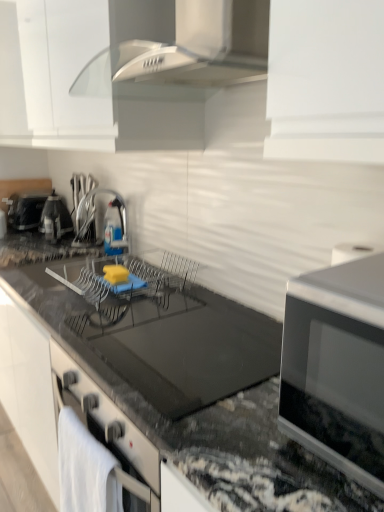
Question: Is satin nickel faucet at center, which ranks as the 1th appliance in front-to-back order, bigger or smaller than transparent plastic bottle at center?

Choices:
 (A) small
 (B) big

Answer: (B)

Question: From a real-world perspective, is satin nickel faucet at center, which ranks as the 1th appliance in front-to-back order, physically located above or below transparent plastic bottle at center?

Choices:
 (A) above
 (B) below

Answer: (A)

Question: Which of these objects is positioned farthest from the black glass countertop at center?

Choices:
 (A) transparent plastic bottle at center
 (B) black plastic toaster at left, which appears as the first appliance when viewed from the back
 (C) metallic silver kettle at left, the second appliance in the right-to-left sequence
 (D) silver metallic microwave at right
 (E) white towel at lower left

Answer: (B)

Question: Considering the real-world distances, which object is closest to the transparent plastic bottle at center?

Choices:
 (A) white matte cabinetry at upper center
 (B) black plastic toaster at left, positioned as the first appliance in left-to-right order
 (C) metallic silver kettle at left, which ranks as the second appliance in front-to-back order
 (D) satin nickel faucet at center, which is the third appliance in back-to-front order
 (E) silver metallic microwave at right

Answer: (D)